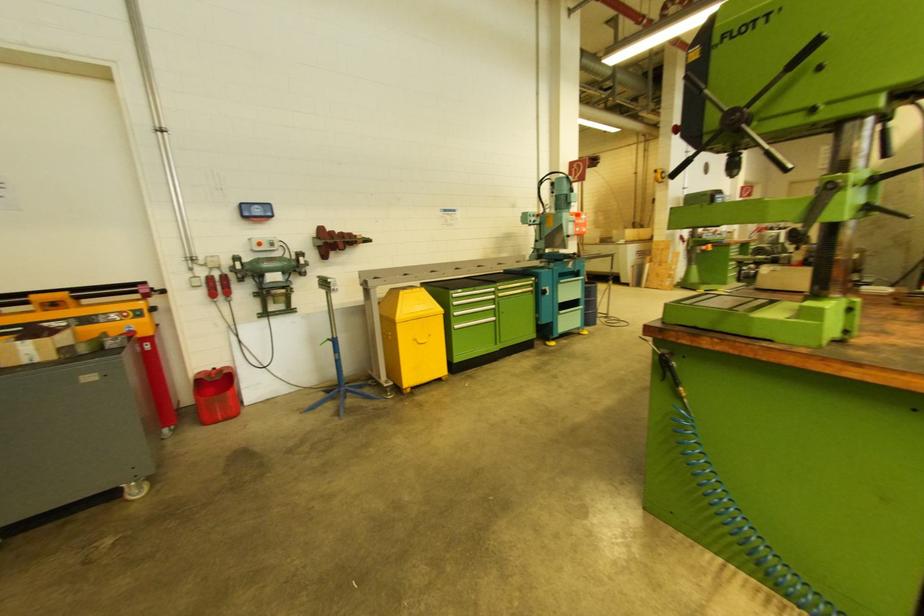
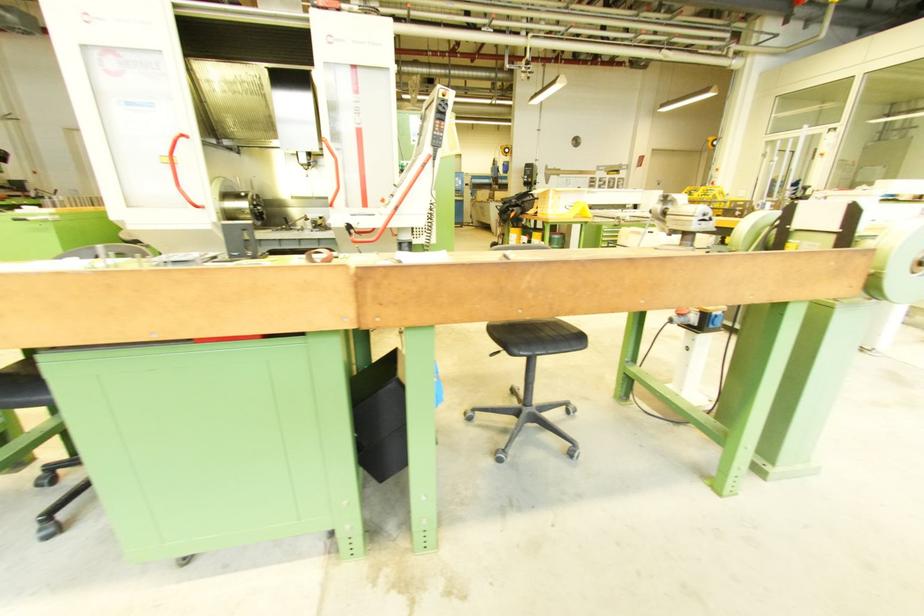
Question: I am providing you with two images of the same scene from different viewpoints. Which of the following objects are not visible in image2?

Choices:
 (A) red push button
 (B) blue cabinet handle
 (C) metal vise handle
 (D) flat cardboard box

Answer: (B)